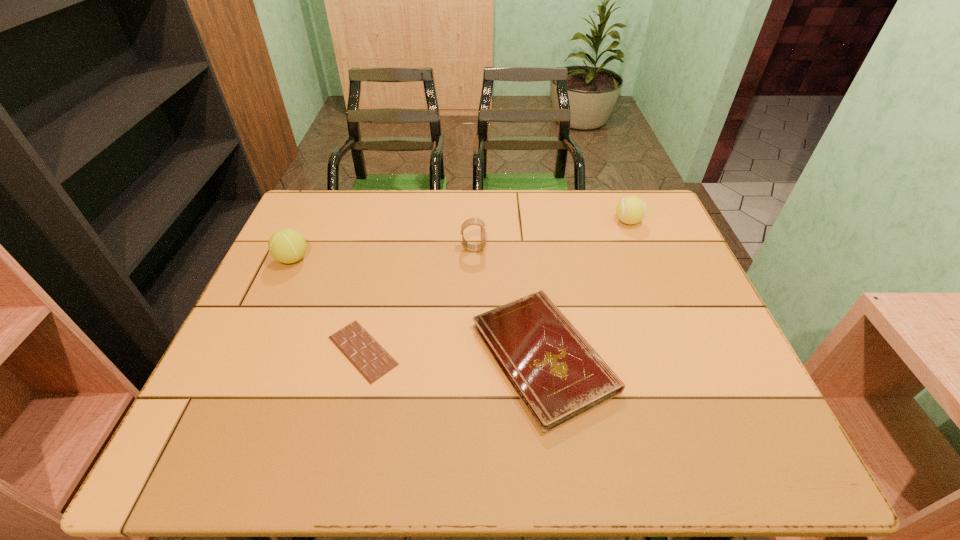
The width and height of the screenshot is (960, 540). Identify the location of vacant area at the right edge. (653, 269).

The width and height of the screenshot is (960, 540). In order to click on blank area at the far left corner in this screenshot , I will do `click(332, 213)`.

This screenshot has width=960, height=540. In the image, there is a desktop. Find the location of `vacant space at the near left corner`. vacant space at the near left corner is located at coordinates (194, 456).

Locate an element on the screen. Image resolution: width=960 pixels, height=540 pixels. free space at the far right corner is located at coordinates (656, 221).

The width and height of the screenshot is (960, 540). I want to click on free spot between the chocolate bar and the fourth tallest object, so click(453, 354).

Find the location of a particular element. vacant area between the nearer tennis ball and the fourth tallest object is located at coordinates (418, 308).

What are the coordinates of `unoccupied position between the rightmost object and the shortest object` in the screenshot? It's located at (495, 286).

The image size is (960, 540). In order to click on vacant region between the left tennis ball and the watch in this screenshot , I will do `click(383, 254)`.

The height and width of the screenshot is (540, 960). What are the coordinates of `free space between the farthest object and the watch` in the screenshot? It's located at (550, 235).

At what (x,y) coordinates should I click in order to perform the action: click on free point between the left tennis ball and the watch. Please return your answer as a coordinate pair (x, y). Image resolution: width=960 pixels, height=540 pixels. Looking at the image, I should click on (383, 254).